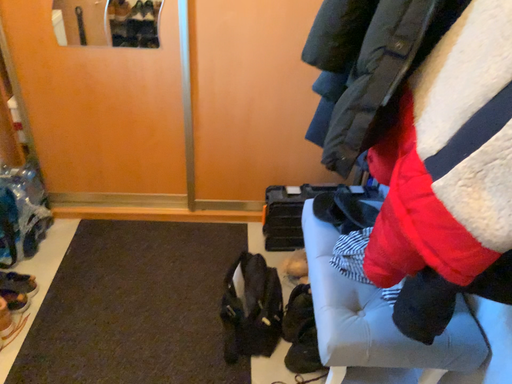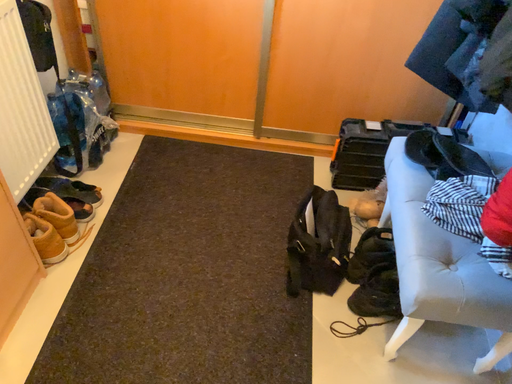
Question: Which way did the camera rotate in the video?

Choices:
 (A) rotated upward
 (B) rotated downward

Answer: (B)